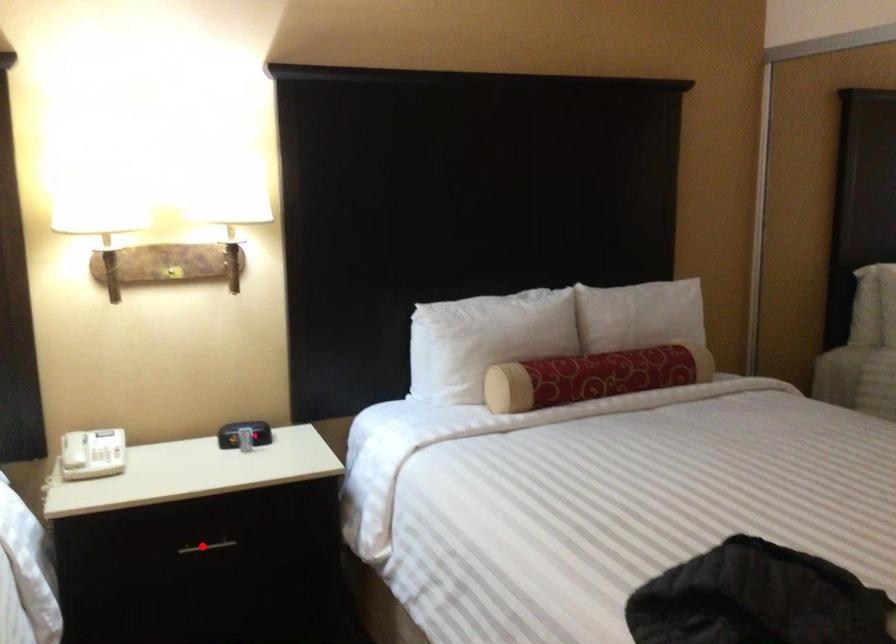
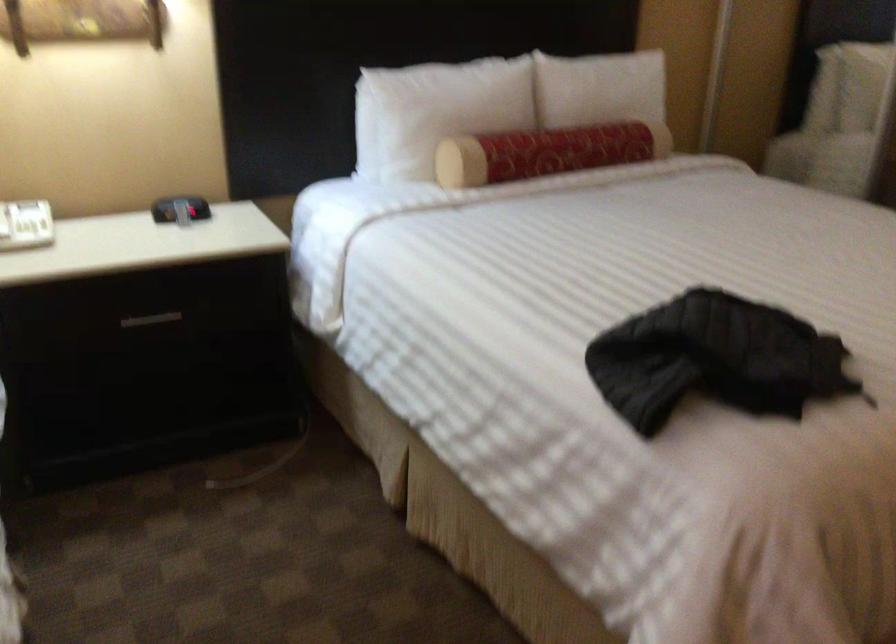
Where in the second image is the point corresponding to the highlighted location from the first image?

(151, 319)